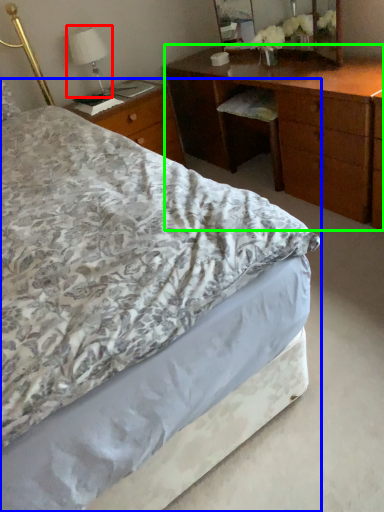
Question: Estimate the real-world distances between objects in this image. Which object is farther from bedside lamp (highlighted by a red box), bed (highlighted by a blue box) or desk (highlighted by a green box)?

Choices:
 (A) bed
 (B) desk

Answer: (A)